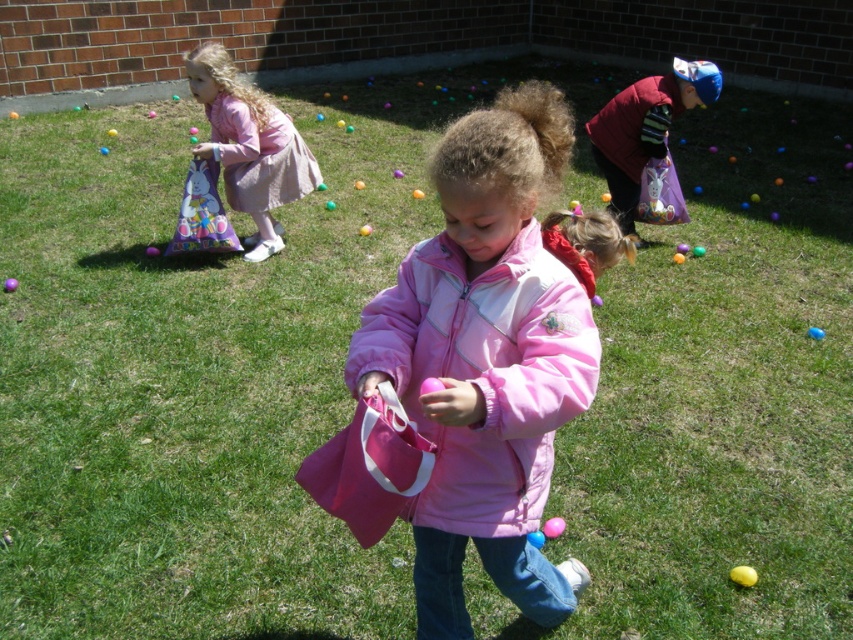
Does pink fabric bag at upper left have a lesser width compared to pink fabric bag at center?

No.

Does point (219, 64) come behind point (614, 237)?

Yes, it is behind point (614, 237).

The width and height of the screenshot is (853, 640). Identify the location of pink fabric bag at upper left. click(248, 145).

Does point (431, 408) lie behind point (820, 333)?

That is False.

Between point (577, 397) and point (822, 333), which one is positioned in front?

Point (577, 397)

Find the location of a particular element. The height and width of the screenshot is (640, 853). pink matte jacket at center is located at coordinates (486, 358).

Is pink fabric bag at upper left in front of purple matte egg at center?

→ That is False.

Which of these two, pink fabric bag at upper left or purple matte egg at center, stands shorter?

With less height is purple matte egg at center.

Which is in front, point (196, 58) or point (3, 288)?

Point (3, 288) is in front.

The width and height of the screenshot is (853, 640). Identify the location of pink fabric bag at upper left. (248, 145).